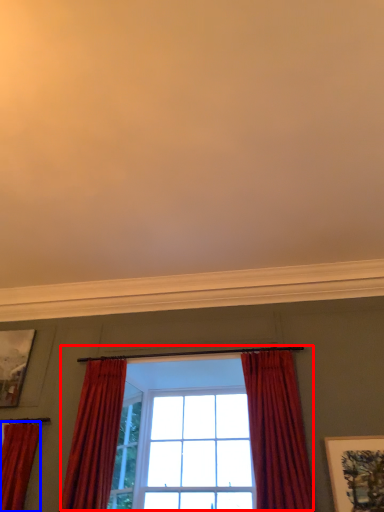
Question: Which object appears closest to the camera in this image, window (highlighted by a red box) or curtain (highlighted by a blue box)?

Choices:
 (A) window
 (B) curtain

Answer: (A)